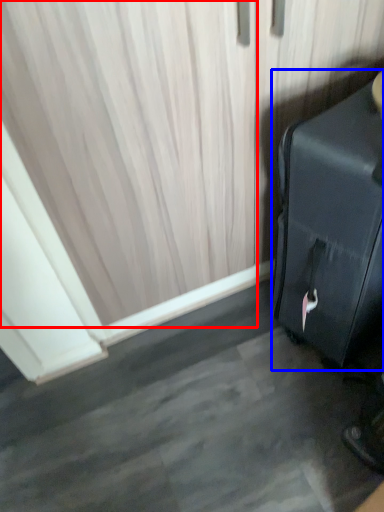
Question: Which object appears closest to the camera in this image, curtain (highlighted by a red box) or suitcase (highlighted by a blue box)?

Choices:
 (A) curtain
 (B) suitcase

Answer: (B)